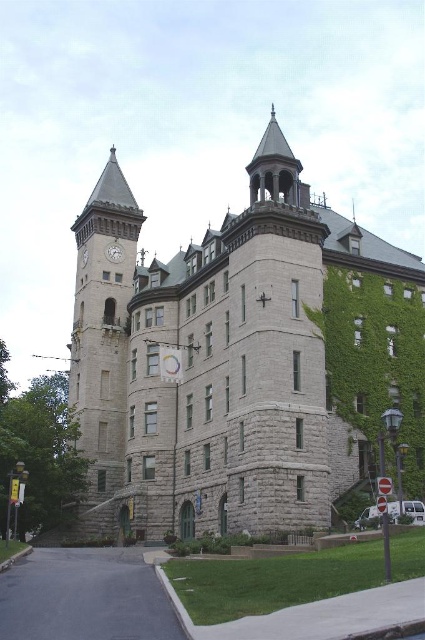
Question: Does gray stone clock tower at left come behind silver metallic clock at upper left?

Choices:
 (A) yes
 (B) no

Answer: (B)

Question: Does gray stone clock tower at left have a lesser width compared to silver metallic clock at upper left?

Choices:
 (A) yes
 (B) no

Answer: (B)

Question: Which of the following is the closest to the observer?

Choices:
 (A) gray stone clock tower at left
 (B) silver metallic clock at upper left

Answer: (A)

Question: Does gray stone clock tower at left appear under silver metallic clock at upper left?

Choices:
 (A) yes
 (B) no

Answer: (A)